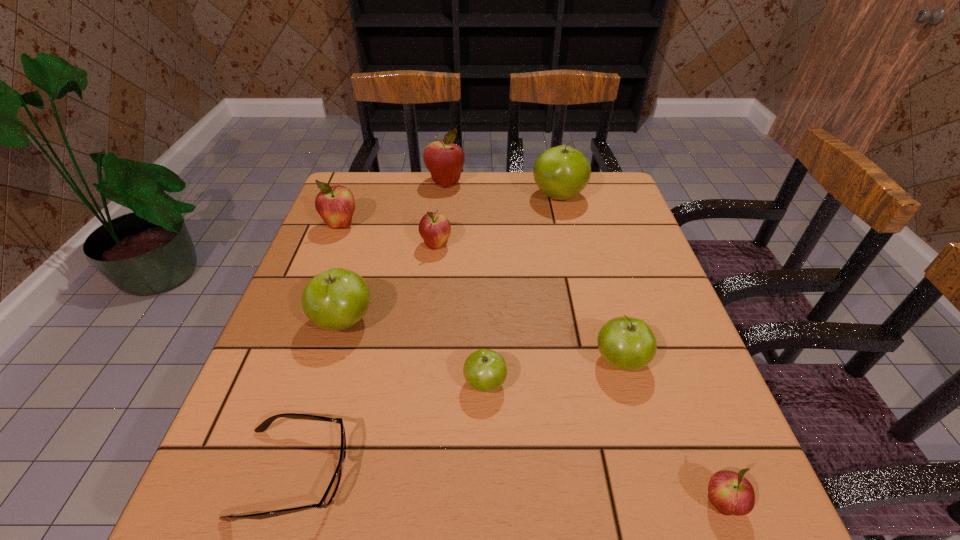
This screenshot has height=540, width=960. Identify the location of spectacles. (330, 493).

Find the location of a particular element. free space located 0.250m on the left of the biggest red apple is located at coordinates (345, 182).

Locate an element on the screen. The image size is (960, 540). free space located on the left of the biggest green apple is located at coordinates (476, 197).

Image resolution: width=960 pixels, height=540 pixels. In order to click on vacant space situated on the front of the leftmost red apple in this screenshot , I will do `click(300, 330)`.

At what (x,y) coordinates should I click in order to perform the action: click on free region located on the back of the second biggest green apple. Please return your answer as a coordinate pair (x, y). The width and height of the screenshot is (960, 540). Looking at the image, I should click on (370, 234).

You are a GUI agent. You are given a task and a screenshot of the screen. Output one action in this format:
    pyautogui.click(x=<x>, y=<y>)
    Task: Click on the vacant region located on the right of the third biggest red apple
    This screenshot has width=960, height=540.
    Given the screenshot: What is the action you would take?
    pyautogui.click(x=479, y=245)

Identify the location of free space located on the back of the third biggest green apple. (588, 242).

Where is `free space located 0.110m on the front of the second green apple from left to right`? This screenshot has width=960, height=540. free space located 0.110m on the front of the second green apple from left to right is located at coordinates (486, 462).

The height and width of the screenshot is (540, 960). I want to click on vacant area located 0.260m on the left of the rightmost object, so click(x=532, y=504).

You are a GUI agent. You are given a task and a screenshot of the screen. Output one action in this format:
    pyautogui.click(x=<x>, y=<y>)
    Task: Click on the vacant space located 0.090m on the front-facing side of the shortest object
    This screenshot has height=540, width=960.
    Given the screenshot: What is the action you would take?
    pyautogui.click(x=403, y=473)